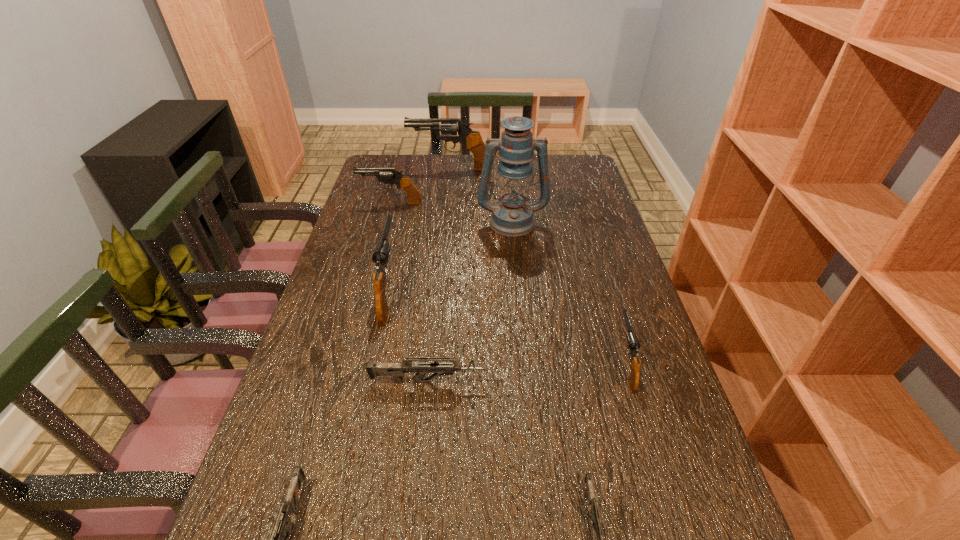
What are the coordinates of `vacant region between the seventh nearest object and the rightmost gun` in the screenshot? It's located at (508, 282).

The width and height of the screenshot is (960, 540). In order to click on free spot between the biggest grey gun and the smallest black gun in this screenshot , I will do `click(528, 372)`.

Where is `vacant area that lies between the fourth shortest gun and the tallest gun`? The width and height of the screenshot is (960, 540). vacant area that lies between the fourth shortest gun and the tallest gun is located at coordinates (538, 266).

At what (x,y) coordinates should I click in order to perform the action: click on free space between the rightmost black gun and the fifth shortest object. Please return your answer as a coordinate pair (x, y). This screenshot has width=960, height=540. Looking at the image, I should click on (508, 282).

Choose which object is the fifth nearest neighbor to the second tallest gun. Please provide its 2D coordinates. Your answer should be formatted as a tuple, i.e. [(x, y)], where the tuple contains the x and y coordinates of a point satisfying the conditions above.

[(472, 140)]

Where is `object that ranks as the fourth closest to the second smallest black gun`? The image size is (960, 540). object that ranks as the fourth closest to the second smallest black gun is located at coordinates (396, 370).

Select which gun appears as the fifth closest to the tallest object. Please provide its 2D coordinates. Your answer should be formatted as a tuple, i.e. [(x, y)], where the tuple contains the x and y coordinates of a point satisfying the conditions above.

[(396, 370)]

Locate an element on the screen. This screenshot has width=960, height=540. the second closest gun to the third tallest object is located at coordinates (386, 175).

This screenshot has height=540, width=960. Identify the location of black gun that is the third closest to the farthest black gun. (633, 344).

Image resolution: width=960 pixels, height=540 pixels. I want to click on black gun that is the closest one to the second shortest gun, so click(x=382, y=249).